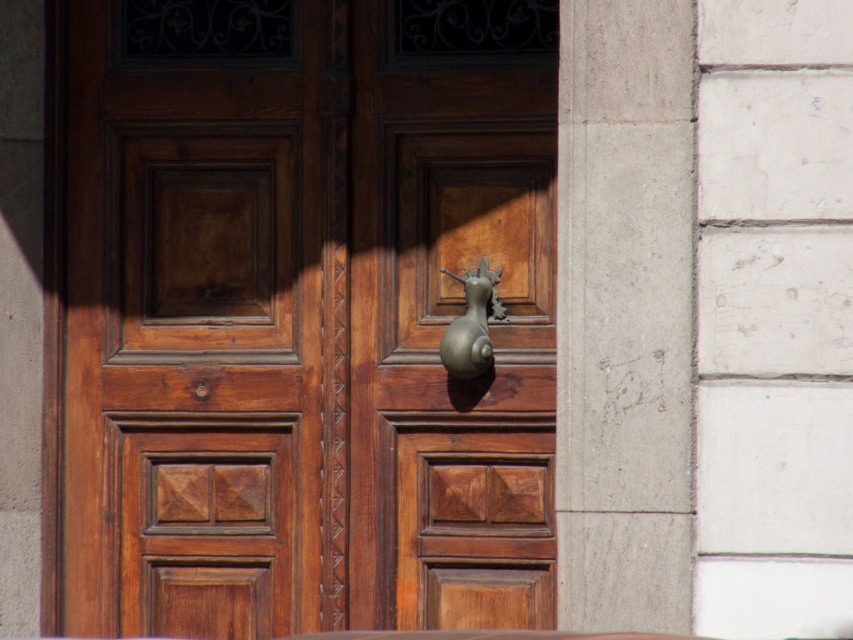
Question: Does matte wood door at center appear on the left side of gray concrete pillar at center?

Choices:
 (A) no
 (B) yes

Answer: (B)

Question: Where is gray concrete pillar at center located in relation to bronze/golden metallic snail at center in the image?

Choices:
 (A) below
 (B) above

Answer: (B)

Question: Estimate the real-world distances between objects in this image. Which object is closer to the gray concrete pillar at center?

Choices:
 (A) matte wood door at center
 (B) bronze/golden metallic snail at center

Answer: (B)

Question: Which object is positioned farthest from the matte wood door at center?

Choices:
 (A) bronze/golden metallic snail at center
 (B) gray concrete pillar at center

Answer: (B)

Question: Which object appears closest to the camera in this image?

Choices:
 (A) gray concrete pillar at center
 (B) bronze/golden metallic snail at center
 (C) matte wood door at center

Answer: (A)

Question: Is matte wood door at center smaller than bronze/golden metallic snail at center?

Choices:
 (A) yes
 (B) no

Answer: (B)